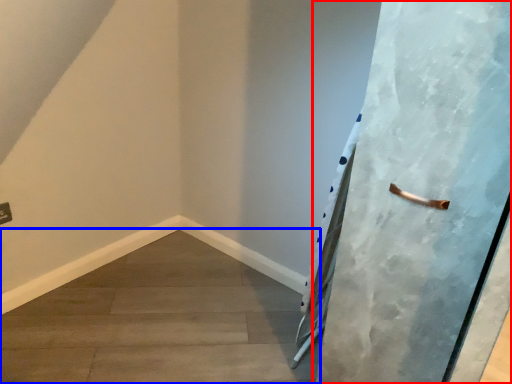
Question: Which point is closer to the camera, door (highlighted by a red box) or concrete (highlighted by a blue box)?

Choices:
 (A) door
 (B) concrete

Answer: (A)